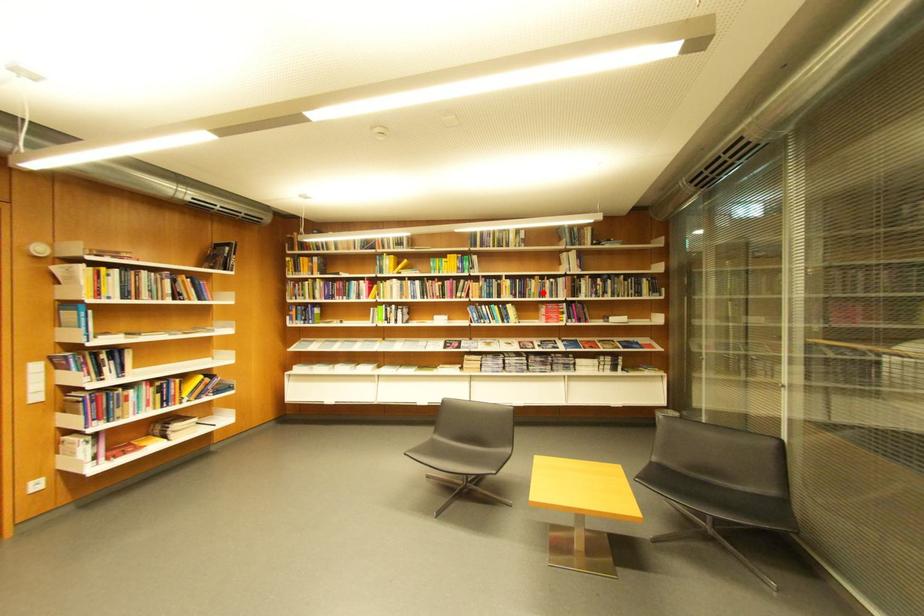
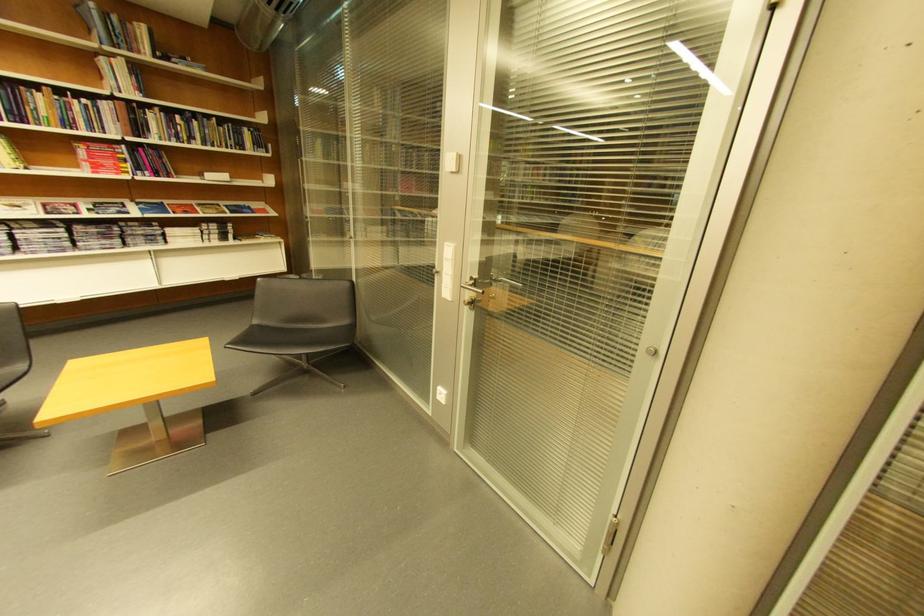
Question: I am providing you with two images of the same scene from different viewpoints. A red point is shown in image1. For the corresponding object point in image2, is it positioned nearer or farther from the camera?

Choices:
 (A) Nearer
 (B) Farther

Answer: (B)